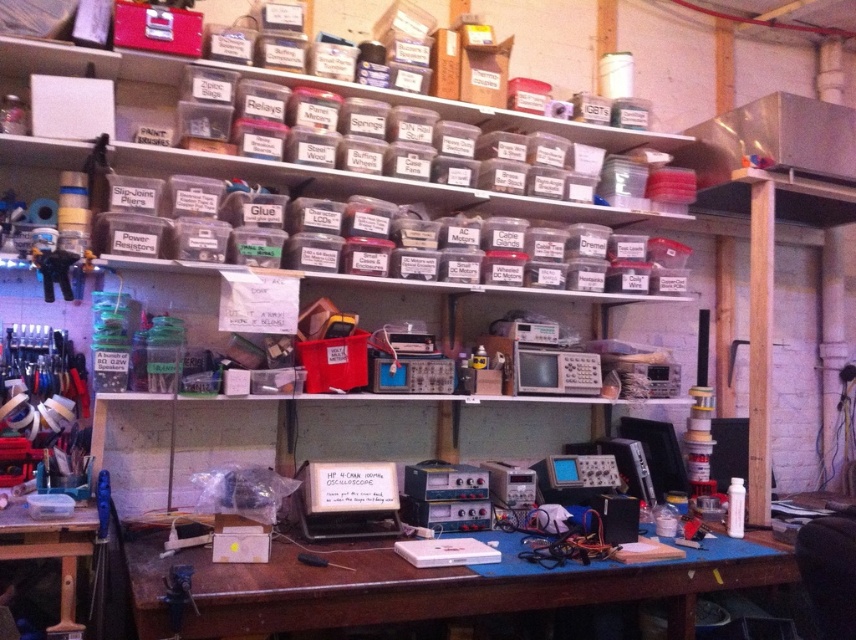
Which of these two, blue plastic table at lower center or clear plastic table at lower left, stands shorter?

clear plastic table at lower left is shorter.

Does blue plastic table at lower center appear on the left side of clear plastic table at lower left?

Incorrect, blue plastic table at lower center is not on the left side of clear plastic table at lower left.

Image resolution: width=856 pixels, height=640 pixels. What are the coordinates of `blue plastic table at lower center` in the screenshot? It's located at (428, 586).

Find the location of a particular element. The image size is (856, 640). blue plastic table at lower center is located at coordinates (428, 586).